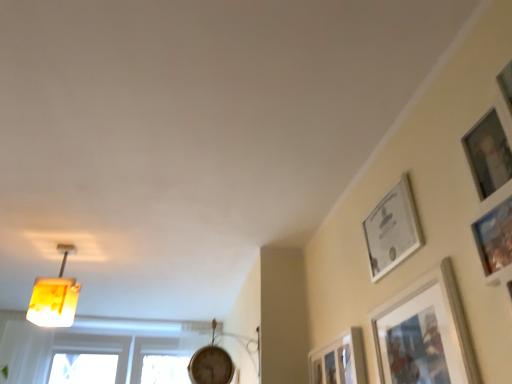
Question: From a real-world perspective, is matte silver picture frame at upper right, the third picture frame viewed from the left, beneath yellow translucent lampshade at upper left?

Choices:
 (A) yes
 (B) no

Answer: (A)

Question: Is matte silver picture frame at upper right, the third picture frame viewed from the left, oriented away from yellow translucent lampshade at upper left?

Choices:
 (A) yes
 (B) no

Answer: (B)

Question: Is matte silver picture frame at upper right, which is the first picture frame in right-to-left order, far from yellow translucent lampshade at upper left?

Choices:
 (A) no
 (B) yes

Answer: (B)

Question: Considering the relative positions of matte silver picture frame at upper right, which is the first picture frame in right-to-left order, and yellow translucent lampshade at upper left in the image provided, is matte silver picture frame at upper right, which is the first picture frame in right-to-left order, in front of yellow translucent lampshade at upper left?

Choices:
 (A) no
 (B) yes

Answer: (B)

Question: Is matte silver picture frame at upper right, which is the first picture frame in right-to-left order, directly adjacent to yellow translucent lampshade at upper left?

Choices:
 (A) yes
 (B) no

Answer: (B)

Question: From the image's perspective, is matte silver picture frame at lower right, which ranks as the 1th picture frame in left-to-right order, located above or below matte silver picture frame at upper right, which is the first picture frame in right-to-left order?

Choices:
 (A) below
 (B) above

Answer: (A)

Question: Is point (313, 370) positioned closer to the camera than point (437, 344)?

Choices:
 (A) farther
 (B) closer

Answer: (A)

Question: From a real-world perspective, is matte silver picture frame at lower right, the 3th picture frame when ordered from right to left, above or below matte silver picture frame at upper right, which is the first picture frame in right-to-left order?

Choices:
 (A) below
 (B) above

Answer: (B)

Question: Is matte silver picture frame at lower right, which ranks as the 1th picture frame in left-to-right order, wider or thinner than matte silver picture frame at upper right, the third picture frame viewed from the left?

Choices:
 (A) thin
 (B) wide

Answer: (B)

Question: Relative to yellow translucent lampshade at upper left, is white glossy picture frame at upper right, the 2th picture frame positioned from the left, in front or behind?

Choices:
 (A) front
 (B) behind

Answer: (A)

Question: From a real-world perspective, is white glossy picture frame at upper right, the 2th picture frame positioned from the left, positioned above or below yellow translucent lampshade at upper left?

Choices:
 (A) above
 (B) below

Answer: (B)

Question: Which is correct: white glossy picture frame at upper right, the 2th picture frame positioned from the left, is inside yellow translucent lampshade at upper left, or outside of it?

Choices:
 (A) inside
 (B) outside

Answer: (B)

Question: Does point (384, 200) appear closer or farther from the camera than point (62, 317)?

Choices:
 (A) closer
 (B) farther

Answer: (A)

Question: In terms of width, does matte silver picture frame at upper right, the third picture frame viewed from the left, look wider or thinner when compared to white glossy picture frame at upper right, the 2th picture frame positioned from the left?

Choices:
 (A) wide
 (B) thin

Answer: (A)

Question: In terms of size, does matte silver picture frame at upper right, which is the first picture frame in right-to-left order, appear bigger or smaller than white glossy picture frame at upper right, the 2th picture frame positioned from the left?

Choices:
 (A) big
 (B) small

Answer: (A)